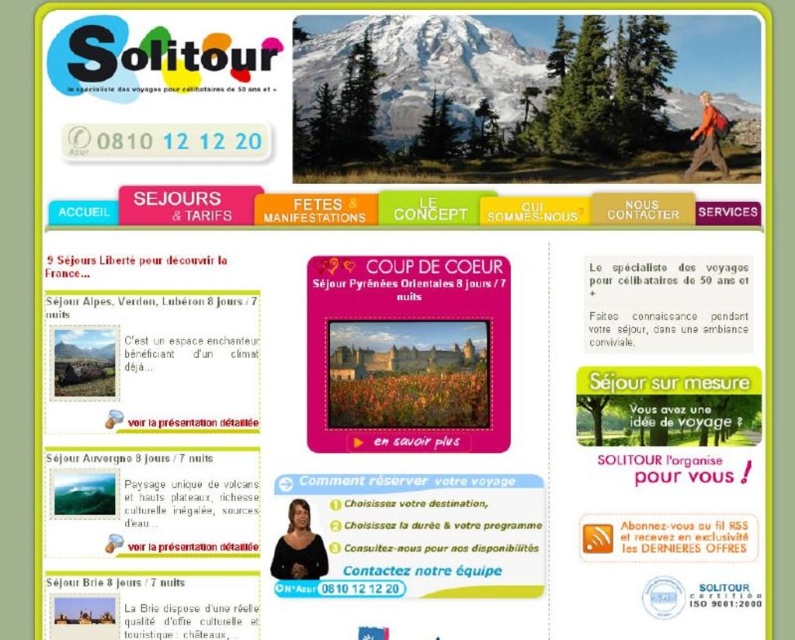
Question: Is matte orange backpack at upper right above matte pink button at center?

Choices:
 (A) yes
 (B) no

Answer: (A)

Question: Which of the following is the farthest from the observer?

Choices:
 (A) (225, 541)
 (B) (691, 156)

Answer: (B)

Question: Which of these objects is positioned farthest from the matte black woman at bottom center?

Choices:
 (A) matte orange backpack at upper right
 (B) matte pink button at center

Answer: (A)

Question: Among these objects, which one is nearest to the camera?

Choices:
 (A) matte pink button at center
 (B) matte orange backpack at upper right
 (C) matte black woman at bottom center

Answer: (C)

Question: Does matte black woman at bottom center appear under matte pink button at center?

Choices:
 (A) no
 (B) yes

Answer: (A)

Question: Does matte black woman at bottom center lie in front of matte orange backpack at upper right?

Choices:
 (A) no
 (B) yes

Answer: (B)